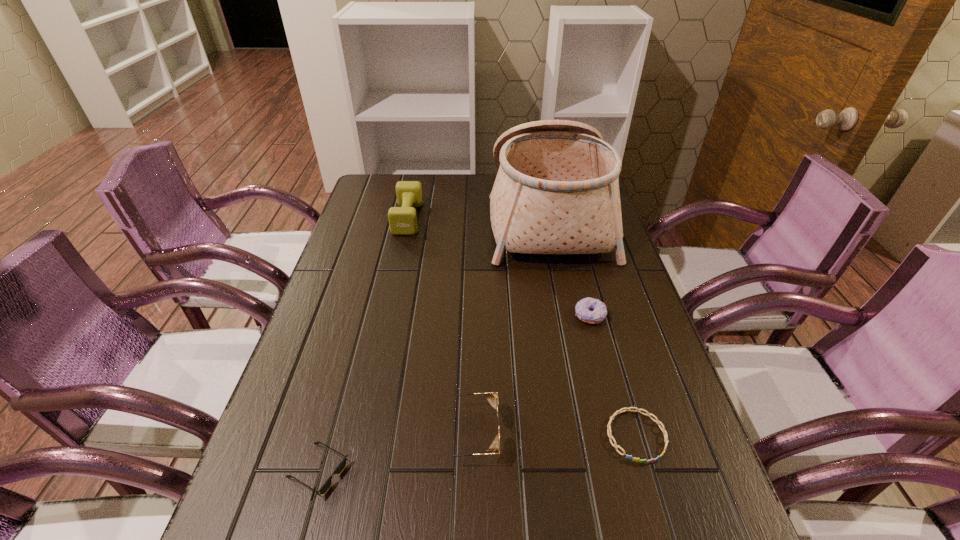
This screenshot has height=540, width=960. What are the coordinates of `unoccupied position between the third shortest object and the basket` in the screenshot? It's located at (569, 265).

Locate an element on the screen. vacant area that lies between the shortest object and the dumbbell is located at coordinates (522, 327).

The image size is (960, 540). I want to click on free space between the second shortest object and the fourth shortest object, so click(394, 452).

In order to click on unoccupied area between the left sunglasses and the shortest object in this screenshot , I will do (x=477, y=453).

Identify the location of vacant region between the bracelet and the shorter sunglasses. The image size is (960, 540). (477, 453).

Identify the location of free area in between the dumbbell and the bracelet. (522, 327).

Image resolution: width=960 pixels, height=540 pixels. What are the coordinates of `unoccupied area between the taller sunglasses and the tallest object` in the screenshot? It's located at (509, 324).

In order to click on vacant space that is in between the dumbbell and the fourth shortest object in this screenshot , I will do `click(439, 326)`.

The height and width of the screenshot is (540, 960). I want to click on vacant region between the tallest object and the taller sunglasses, so click(509, 324).

Locate an element on the screen. vacant area that lies between the right sunglasses and the fourth tallest object is located at coordinates (530, 374).